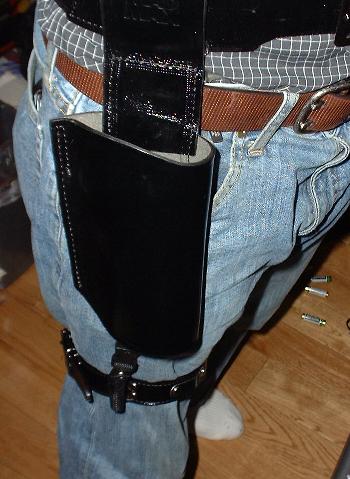
Locate an element on the screen. The width and height of the screenshot is (350, 479). wood floor is located at coordinates (43, 407).